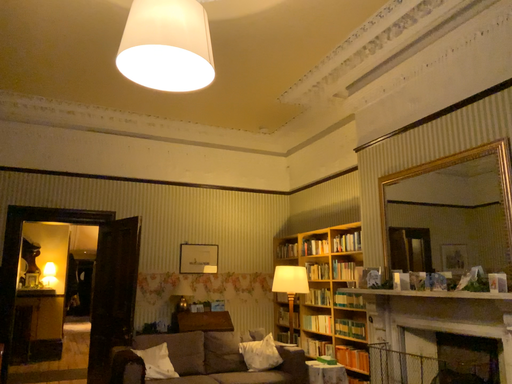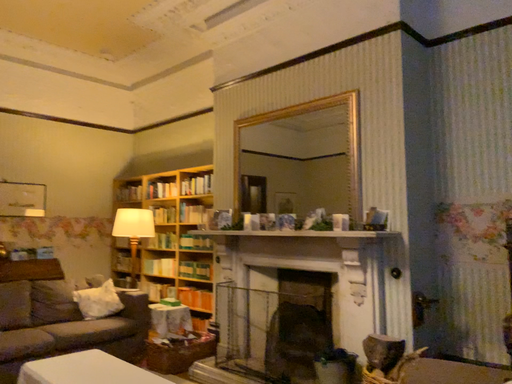
Question: Which way did the camera rotate in the video?

Choices:
 (A) rotated left
 (B) rotated right

Answer: (B)